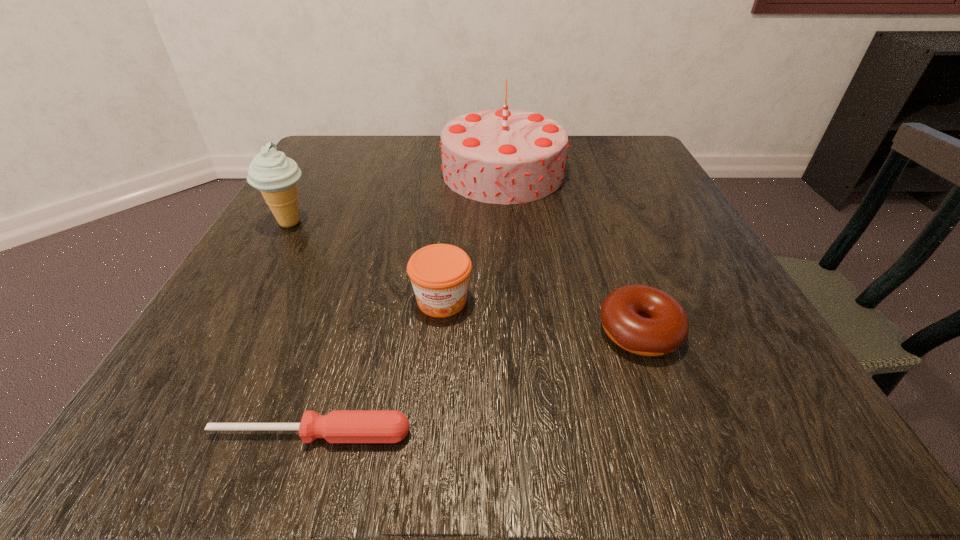
Image resolution: width=960 pixels, height=540 pixels. Find the location of `the farthest object`. the farthest object is located at coordinates (505, 156).

Where is `birthday cake`? Image resolution: width=960 pixels, height=540 pixels. birthday cake is located at coordinates coord(505,156).

The height and width of the screenshot is (540, 960). I want to click on the fourth shortest object, so click(x=275, y=175).

Identify the location of icecream. (275, 175).

You are a GUI agent. You are given a task and a screenshot of the screen. Output one action in this format:
    pyautogui.click(x=<x>, y=<y>)
    Task: Click on the jam
    This screenshot has width=960, height=540.
    Given the screenshot: What is the action you would take?
    pyautogui.click(x=439, y=273)

Locate an element on the screen. The height and width of the screenshot is (540, 960). doughnut is located at coordinates (x=644, y=320).

You are a GUI agent. You are given a task and a screenshot of the screen. Output one action in this format:
    pyautogui.click(x=<x>, y=<y>)
    Task: Click on the shortest object
    
    Given the screenshot: What is the action you would take?
    pyautogui.click(x=339, y=426)

The width and height of the screenshot is (960, 540). I want to click on screwdriver, so (339, 426).

Image resolution: width=960 pixels, height=540 pixels. In order to click on vacant region located 0.120m on the right of the tallest object in this screenshot , I will do `click(622, 173)`.

Find the location of a particular element. The image size is (960, 540). vacant space located 0.390m on the right of the fourth nearest object is located at coordinates tap(531, 222).